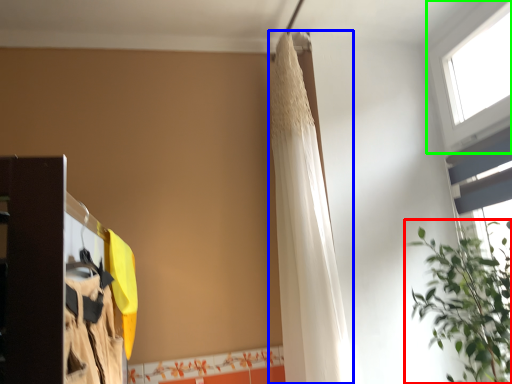
Question: Which object is the farthest from houseplant (highlighted by a red box)? Choose among these: shower curtain (highlighted by a blue box) or window (highlighted by a green box).

Choices:
 (A) shower curtain
 (B) window

Answer: (B)